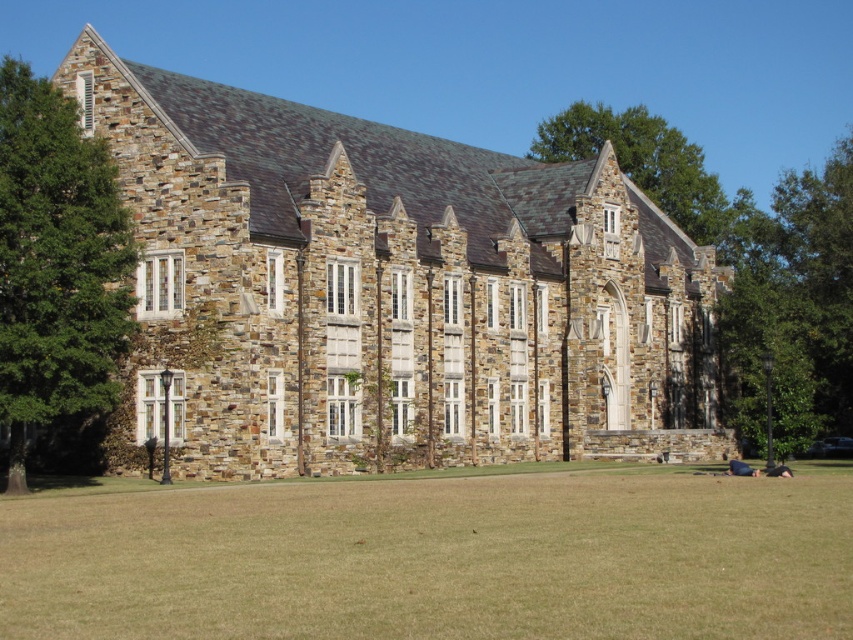
How far apart are green leafy tree at center and green leafy tree at left?

green leafy tree at center and green leafy tree at left are 183.89 feet apart from each other.

Which is below, green leafy tree at center or green leafy tree at left?

Positioned lower is green leafy tree at center.

Where is `green leafy tree at center`? Image resolution: width=853 pixels, height=640 pixels. green leafy tree at center is located at coordinates (749, 266).

Between green leafy tree at left and green leafy tree at upper right, which one has more height?

green leafy tree at left

Is green leafy tree at left taller than green leafy tree at upper right?

Yes.

You are a GUI agent. You are given a task and a screenshot of the screen. Output one action in this format:
    pyautogui.click(x=<x>, y=<y>)
    Task: Click on the green leafy tree at left
    This screenshot has width=853, height=640.
    Given the screenshot: What is the action you would take?
    pyautogui.click(x=56, y=262)

Is point (16, 550) closer to camera compared to point (741, 189)?

Yes, it is.

Is green grass at lower center positioned behind green leafy tree at center?

That is False.

Between point (253, 518) and point (567, 109), which one is positioned in front?

Point (253, 518) is more forward.

At what (x,y) coordinates should I click in order to perform the action: click on green grass at lower center. Please return your answer as a coordinate pair (x, y). Image resolution: width=853 pixels, height=640 pixels. Looking at the image, I should click on (434, 554).